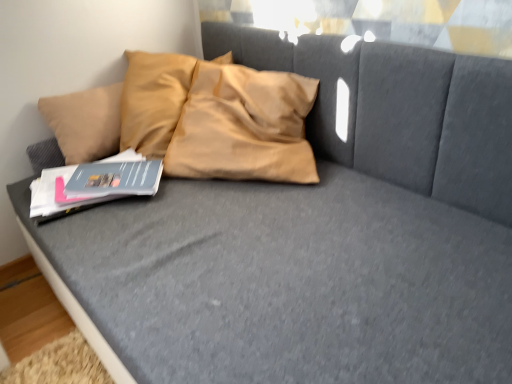
The image size is (512, 384). Find the location of `matte blue paperback book at center-left, the second paperback book in the front-to-back sequence`. matte blue paperback book at center-left, the second paperback book in the front-to-back sequence is located at coordinates pos(115,179).

Image resolution: width=512 pixels, height=384 pixels. Describe the element at coordinates (115, 179) in the screenshot. I see `matte blue paperback book at center-left, marked as the 1th paperback book in a back-to-front arrangement` at that location.

Measure the distance between matte blue paperback book at left, the first paperback book positioned from the front, and camera.

The distance of matte blue paperback book at left, the first paperback book positioned from the front, from camera is 1.11 meters.

Image resolution: width=512 pixels, height=384 pixels. What do you see at coordinates (57, 196) in the screenshot? I see `matte blue paperback book at left, the first paperback book positioned from the front` at bounding box center [57, 196].

Identify the location of matte blue paperback book at left, arranged as the 2th paperback book when viewed from the back. (57, 196).

What is the approximate height of matte blue paperback book at left, the first paperback book positioned from the front?

matte blue paperback book at left, the first paperback book positioned from the front, is 1.52 inches tall.

Identify the location of matte blue paperback book at center-left, marked as the 1th paperback book in a back-to-front arrangement. Image resolution: width=512 pixels, height=384 pixels. (115, 179).

Does matte blue paperback book at center-left, the second paperback book in the front-to-back sequence, appear on the right side of matte blue paperback book at left, the first paperback book positioned from the front?

Correct, you'll find matte blue paperback book at center-left, the second paperback book in the front-to-back sequence, to the right of matte blue paperback book at left, the first paperback book positioned from the front.

Based on the photo, in the image, is matte blue paperback book at center-left, marked as the 1th paperback book in a back-to-front arrangement, positioned in front of or behind matte blue paperback book at left, the first paperback book positioned from the front?

Clearly, matte blue paperback book at center-left, marked as the 1th paperback book in a back-to-front arrangement, is behind matte blue paperback book at left, the first paperback book positioned from the front.

Which point is more distant from viewer, (99, 195) or (53, 205)?

Point (99, 195)

From the image's perspective, is matte blue paperback book at center-left, marked as the 1th paperback book in a back-to-front arrangement, positioned above or below matte blue paperback book at left, arranged as the 2th paperback book when viewed from the back?

Clearly, from the image's perspective, matte blue paperback book at center-left, marked as the 1th paperback book in a back-to-front arrangement, is above matte blue paperback book at left, arranged as the 2th paperback book when viewed from the back.

From a real-world perspective, is matte blue paperback book at center-left, marked as the 1th paperback book in a back-to-front arrangement, positioned under matte blue paperback book at left, the first paperback book positioned from the front, based on gravity?

Actually, matte blue paperback book at center-left, marked as the 1th paperback book in a back-to-front arrangement, is physically above matte blue paperback book at left, the first paperback book positioned from the front, in the real world.

Considering the relative sizes of matte blue paperback book at center-left, the second paperback book in the front-to-back sequence, and matte blue paperback book at left, the first paperback book positioned from the front, in the image provided, is matte blue paperback book at center-left, the second paperback book in the front-to-back sequence, thinner than matte blue paperback book at left, the first paperback book positioned from the front,?

Indeed, matte blue paperback book at center-left, the second paperback book in the front-to-back sequence, has a lesser width compared to matte blue paperback book at left, the first paperback book positioned from the front.

Considering the sizes of matte blue paperback book at center-left, the second paperback book in the front-to-back sequence, and matte blue paperback book at left, arranged as the 2th paperback book when viewed from the back, in the image, is matte blue paperback book at center-left, the second paperback book in the front-to-back sequence, taller or shorter than matte blue paperback book at left, arranged as the 2th paperback book when viewed from the back,?

matte blue paperback book at center-left, the second paperback book in the front-to-back sequence, is shorter than matte blue paperback book at left, arranged as the 2th paperback book when viewed from the back.

Does matte blue paperback book at center-left, the second paperback book in the front-to-back sequence, have a larger size compared to matte blue paperback book at left, the first paperback book positioned from the front?

Incorrect, matte blue paperback book at center-left, the second paperback book in the front-to-back sequence, is not larger than matte blue paperback book at left, the first paperback book positioned from the front.

Does matte blue paperback book at center-left, marked as the 1th paperback book in a back-to-front arrangement, contain matte blue paperback book at left, arranged as the 2th paperback book when viewed from the back?

No, matte blue paperback book at center-left, marked as the 1th paperback book in a back-to-front arrangement, does not contain matte blue paperback book at left, arranged as the 2th paperback book when viewed from the back.

Would you consider matte blue paperback book at center-left, marked as the 1th paperback book in a back-to-front arrangement, to be distant from matte blue paperback book at left, the first paperback book positioned from the front?

No, there isn't a large distance between matte blue paperback book at center-left, marked as the 1th paperback book in a back-to-front arrangement, and matte blue paperback book at left, the first paperback book positioned from the front.

Based on the photo, is matte blue paperback book at center-left, marked as the 1th paperback book in a back-to-front arrangement, facing away from matte blue paperback book at left, arranged as the 2th paperback book when viewed from the back?

matte blue paperback book at center-left, marked as the 1th paperback book in a back-to-front arrangement, does not have its back to matte blue paperback book at left, arranged as the 2th paperback book when viewed from the back.

Identify the location of paperback book lying on the left of matte blue paperback book at center-left, marked as the 1th paperback book in a back-to-front arrangement. This screenshot has width=512, height=384. (57, 196).

Which is more to the right, matte blue paperback book at left, arranged as the 2th paperback book when viewed from the back, or matte blue paperback book at center-left, the second paperback book in the front-to-back sequence?

Positioned to the right is matte blue paperback book at center-left, the second paperback book in the front-to-back sequence.

Is matte blue paperback book at left, arranged as the 2th paperback book when viewed from the back, further to camera compared to matte blue paperback book at center-left, the second paperback book in the front-to-back sequence?

That is False.

Is point (139, 159) closer or farther from the camera than point (140, 192)?

Point (139, 159) is farther from the camera than point (140, 192).

From the image's perspective, relative to matte blue paperback book at center-left, marked as the 1th paperback book in a back-to-front arrangement, is matte blue paperback book at left, the first paperback book positioned from the front, above or below?

Based on their image positions, matte blue paperback book at left, the first paperback book positioned from the front, is located beneath matte blue paperback book at center-left, marked as the 1th paperback book in a back-to-front arrangement.

From a real-world perspective, does matte blue paperback book at left, arranged as the 2th paperback book when viewed from the back, sit lower than matte blue paperback book at center-left, marked as the 1th paperback book in a back-to-front arrangement?

Indeed, from a real-world perspective, matte blue paperback book at left, arranged as the 2th paperback book when viewed from the back, is positioned beneath matte blue paperback book at center-left, marked as the 1th paperback book in a back-to-front arrangement.

Which object is wider, matte blue paperback book at left, arranged as the 2th paperback book when viewed from the back, or matte blue paperback book at center-left, marked as the 1th paperback book in a back-to-front arrangement?

→ matte blue paperback book at left, arranged as the 2th paperback book when viewed from the back.

Considering the sizes of objects matte blue paperback book at left, arranged as the 2th paperback book when viewed from the back, and matte blue paperback book at center-left, the second paperback book in the front-to-back sequence, in the image provided, who is taller, matte blue paperback book at left, arranged as the 2th paperback book when viewed from the back, or matte blue paperback book at center-left, the second paperback book in the front-to-back sequence,?

matte blue paperback book at left, arranged as the 2th paperback book when viewed from the back, is taller.

Based on their sizes in the image, would you say matte blue paperback book at left, the first paperback book positioned from the front, is bigger or smaller than matte blue paperback book at center-left, marked as the 1th paperback book in a back-to-front arrangement?

Clearly, matte blue paperback book at left, the first paperback book positioned from the front, is larger in size than matte blue paperback book at center-left, marked as the 1th paperback book in a back-to-front arrangement.

In the scene shown: Is matte blue paperback book at left, arranged as the 2th paperback book when viewed from the back, situated inside matte blue paperback book at center-left, the second paperback book in the front-to-back sequence, or outside?

matte blue paperback book at left, arranged as the 2th paperback book when viewed from the back, is spatially situated outside matte blue paperback book at center-left, the second paperback book in the front-to-back sequence.

Is matte blue paperback book at left, the first paperback book positioned from the front, far from matte blue paperback book at center-left, marked as the 1th paperback book in a back-to-front arrangement?

matte blue paperback book at left, the first paperback book positioned from the front, is near matte blue paperback book at center-left, marked as the 1th paperback book in a back-to-front arrangement, not far away.

Is matte blue paperback book at left, the first paperback book positioned from the front, oriented towards matte blue paperback book at center-left, the second paperback book in the front-to-back sequence?

No, matte blue paperback book at left, the first paperback book positioned from the front, is not turned towards matte blue paperback book at center-left, the second paperback book in the front-to-back sequence.

Find the location of a particular element. This screenshot has height=384, width=512. paperback book behind the matte blue paperback book at left, arranged as the 2th paperback book when viewed from the back is located at coordinates (115, 179).

Locate an element on the screen. This screenshot has height=384, width=512. paperback book above the matte blue paperback book at left, the first paperback book positioned from the front (from the image's perspective) is located at coordinates (115, 179).

Find the location of a particular element. This screenshot has height=384, width=512. paperback book positioned vertically above the matte blue paperback book at left, the first paperback book positioned from the front (from a real-world perspective) is located at coordinates (115, 179).